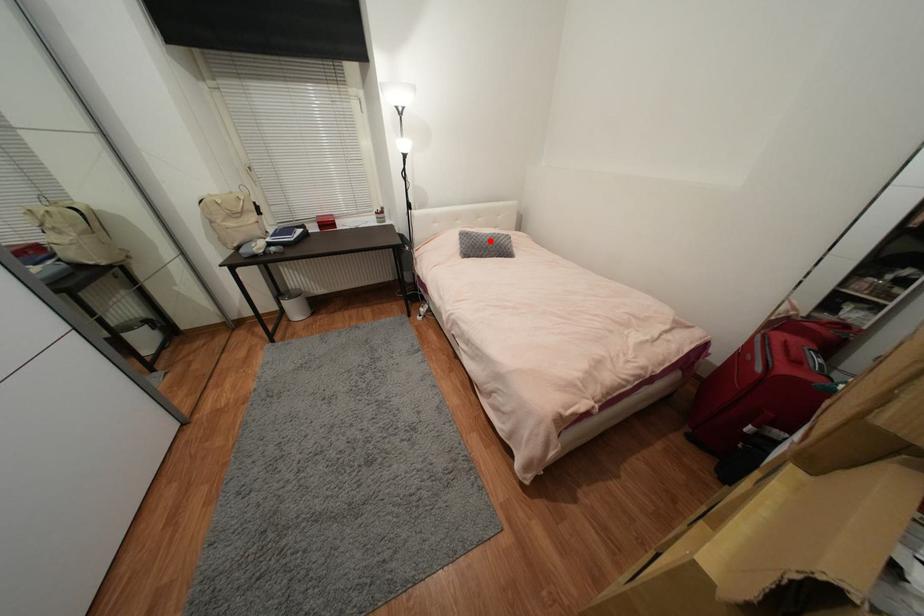
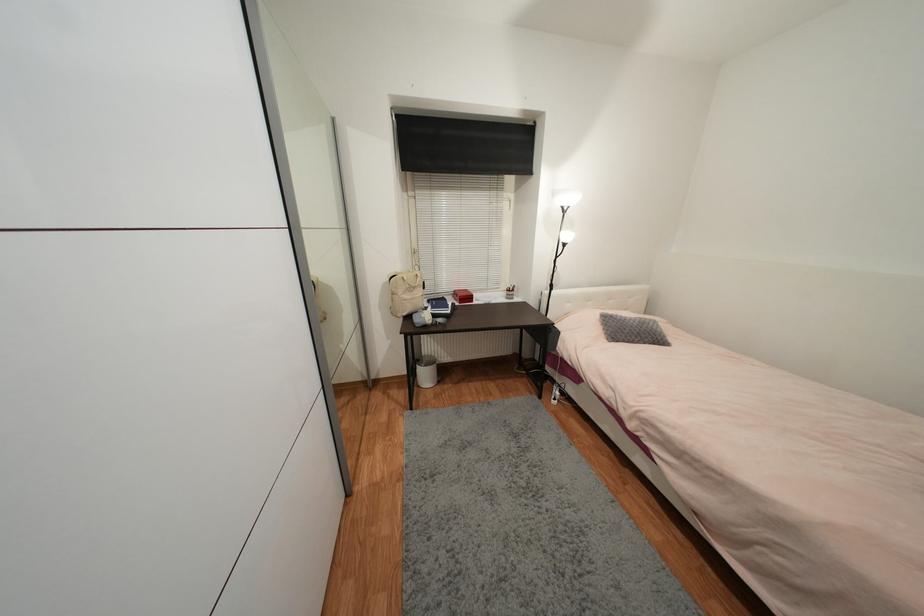
Locate, in the second image, the point that corresponds to the highlighted location in the first image.

(639, 326)